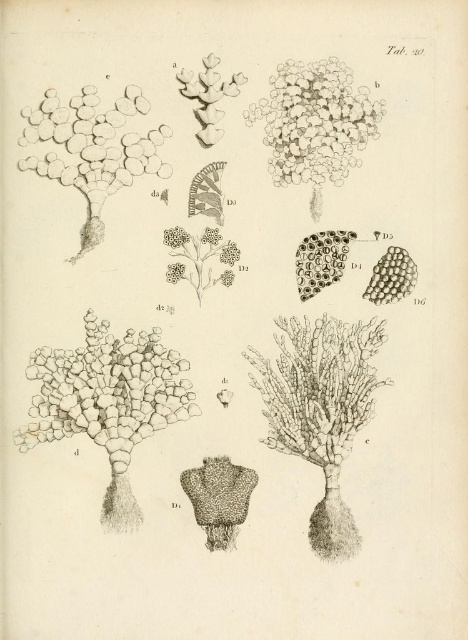
Based on the botanical illustration provided, what specific plant structure is located at the coordinates point (x=321, y=410)?

The gray textured plant at center is located at point (x=321, y=410).

In the botanical illustration, you see a gray textured plant at center and smooth white pebbles at upper left. Which object is located above the other?

The smooth white pebbles at upper left are above the gray textured plant at center because the gray textured plant at center is positioned under them.